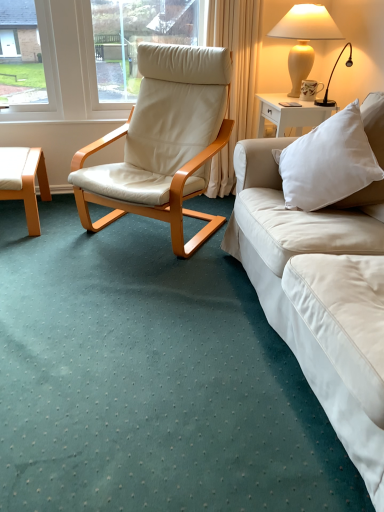
Question: From a real-world perspective, relative to light brown wood coffee table at left, is matte ceramic mug at upper right vertically above or below?

Choices:
 (A) above
 (B) below

Answer: (A)

Question: Based on their sizes in the image, would you say matte ceramic mug at upper right is bigger or smaller than light brown wood coffee table at left?

Choices:
 (A) big
 (B) small

Answer: (B)

Question: Which is farther from the matte cream vase at upper right?

Choices:
 (A) matte ceramic mug at upper right
 (B) beige leather chair at center
 (C) white soft cushion at right
 (D) light brown wood coffee table at left

Answer: (D)

Question: Which object is positioned closest to the light brown wood coffee table at left?

Choices:
 (A) beige leather chair at center
 (B) white soft cushion at right
 (C) matte ceramic mug at upper right
 (D) matte cream vase at upper right

Answer: (A)